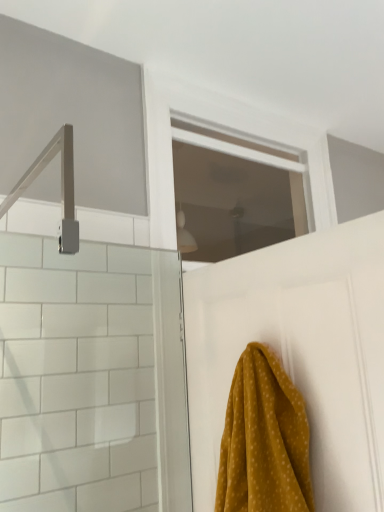
Question: Is white matte door at upper center spatially inside transparent glass window at center, or outside of it?

Choices:
 (A) outside
 (B) inside

Answer: (A)

Question: From a real-world perspective, is white matte door at upper center physically located above or below transparent glass window at center?

Choices:
 (A) below
 (B) above

Answer: (A)

Question: Estimate the real-world distances between objects in this image. Which object is closer to the mustard yellow fabric at lower right?

Choices:
 (A) white matte door at upper center
 (B) transparent glass window at center

Answer: (A)

Question: Which object is positioned closest to the white matte door at upper center?

Choices:
 (A) mustard yellow fabric at lower right
 (B) transparent glass window at center

Answer: (A)